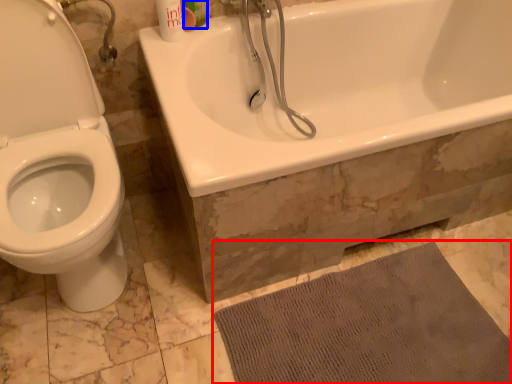
Question: Which object is closer to the camera taking this photo, bath mat (highlighted by a red box) or mouthwash (highlighted by a blue box)?

Choices:
 (A) bath mat
 (B) mouthwash

Answer: (A)